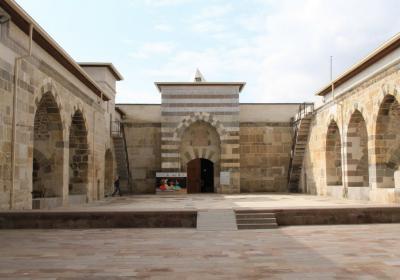
Where is `wooden arch lft door`? wooden arch lft door is located at coordinates (x=192, y=169).